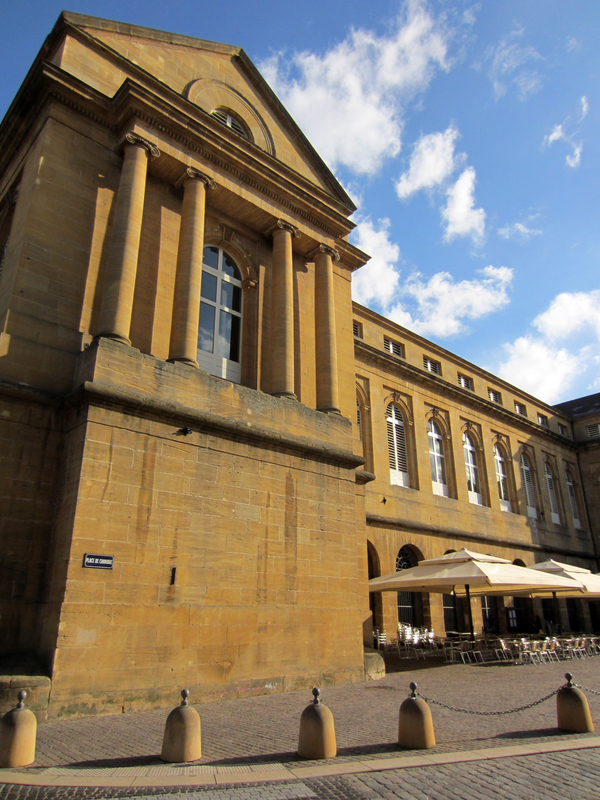
I want to click on chair, so click(553, 650).